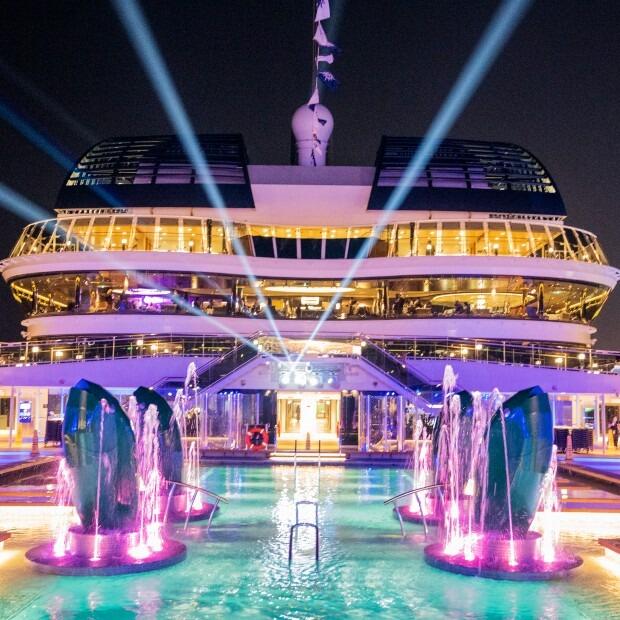
You are a GUI agent. You are given a task and a screenshot of the screen. Output one action in this format:
    pyautogui.click(x=<x>, y=<y>)
    Task: Click on the lights
    
    Given the screenshot: What is the action you would take?
    pos(301,360)